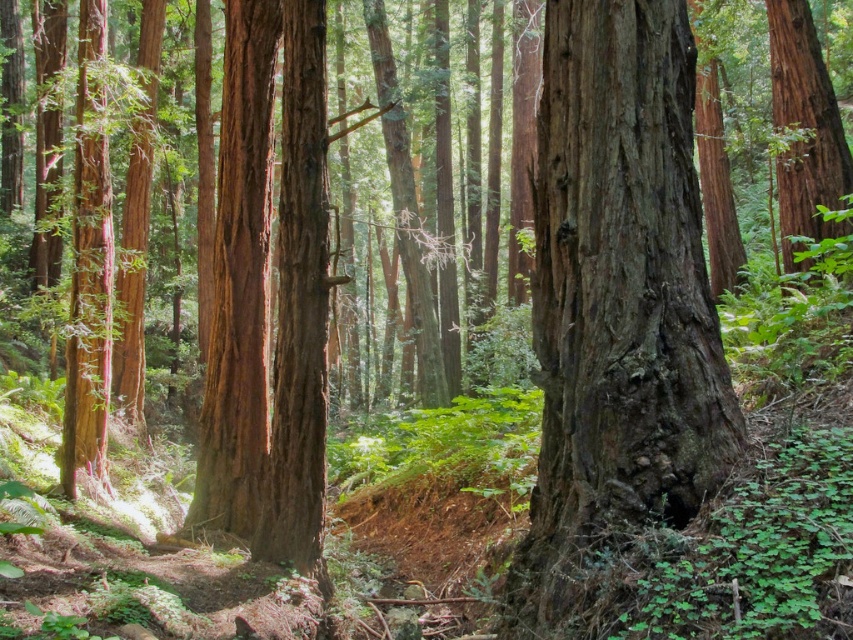
You are a hiker who wants to take a photo of both the rough bark tree at center and the smooth brown tree trunk at right. Since you want both trees in focus, which one should you focus on first to ensure the other is also in the frame?

You should focus on the rough bark tree at center first because it is closer to the viewer than the smooth brown tree trunk at right, so adjusting focus to include both would require starting with the closer object.